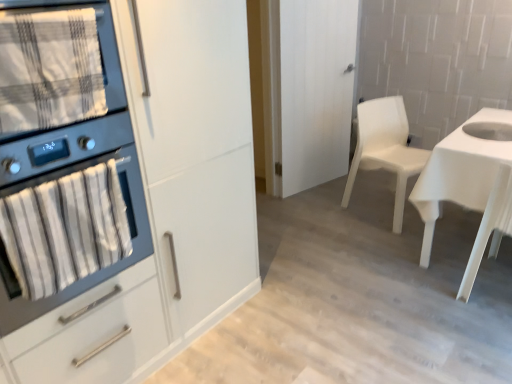
Question: Considering the relative sizes of white matte cabinet at left and matte black oven at left in the image provided, is white matte cabinet at left taller than matte black oven at left?

Choices:
 (A) yes
 (B) no

Answer: (A)

Question: Considering the relative sizes of white matte cabinet at left and matte black oven at left in the image provided, is white matte cabinet at left wider than matte black oven at left?

Choices:
 (A) yes
 (B) no

Answer: (A)

Question: Is white matte cabinet at left in front of matte black oven at left?

Choices:
 (A) yes
 (B) no

Answer: (A)

Question: Can we say white matte cabinet at left lies outside matte black oven at left?

Choices:
 (A) no
 (B) yes

Answer: (B)

Question: Is white matte cabinet at left facing towards matte black oven at left?

Choices:
 (A) no
 (B) yes

Answer: (B)

Question: From the image's perspective, is matte black oven at left positioned above or below plaid fabric towel at left?

Choices:
 (A) above
 (B) below

Answer: (B)

Question: Is matte black oven at left situated inside plaid fabric towel at left or outside?

Choices:
 (A) inside
 (B) outside

Answer: (B)

Question: Is matte black oven at left taller or shorter than plaid fabric towel at left?

Choices:
 (A) tall
 (B) short

Answer: (A)

Question: Is matte black oven at left wider or thinner than plaid fabric towel at left?

Choices:
 (A) thin
 (B) wide

Answer: (B)

Question: Would you say plaid fabric towel at left is to the left or to the right of matte black oven at left in the picture?

Choices:
 (A) right
 (B) left

Answer: (A)

Question: Considering the positions of point (31, 104) and point (9, 276), is point (31, 104) closer or farther from the camera than point (9, 276)?

Choices:
 (A) farther
 (B) closer

Answer: (B)

Question: Is plaid fabric towel at left spatially inside matte black oven at left, or outside of it?

Choices:
 (A) inside
 (B) outside

Answer: (A)

Question: Considering the positions of plaid fabric towel at left and matte black oven at left in the image, is plaid fabric towel at left bigger or smaller than matte black oven at left?

Choices:
 (A) small
 (B) big

Answer: (A)

Question: From the image's perspective, is white glossy desk at right located above or below plaid fabric towel at left?

Choices:
 (A) below
 (B) above

Answer: (A)

Question: From a real-world perspective, relative to plaid fabric towel at left, is white glossy desk at right vertically above or below?

Choices:
 (A) below
 (B) above

Answer: (A)